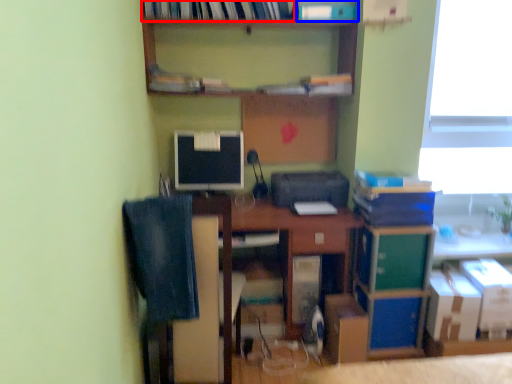
Question: Which point is further to the camera, book (highlighted by a red box) or book (highlighted by a blue box)?

Choices:
 (A) book
 (B) book

Answer: (B)